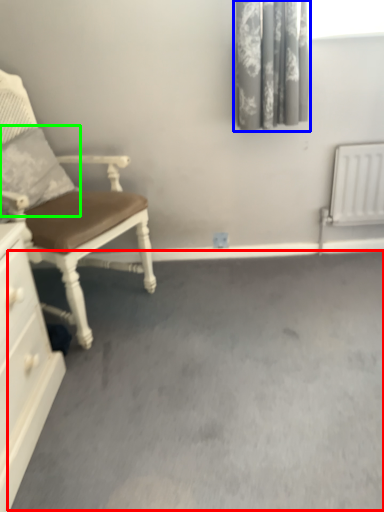
Question: Which object is positioned closest to concrete (highlighted by a red box)? Select from curtain (highlighted by a blue box) and pillow (highlighted by a green box).

Choices:
 (A) curtain
 (B) pillow

Answer: (B)